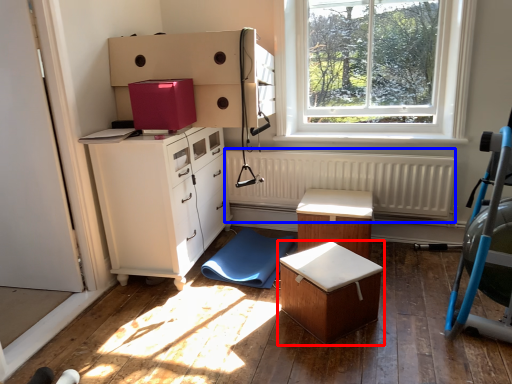
Question: Which of the following is the closest to the observer, table (highlighted by a red box) or radiator (highlighted by a blue box)?

Choices:
 (A) table
 (B) radiator

Answer: (A)